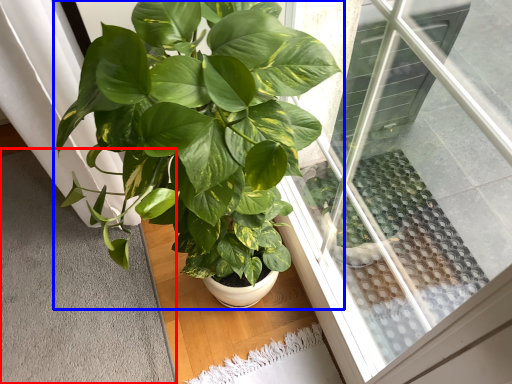
Question: Which object is closer to the camera taking this photo, gray (highlighted by a red box) or houseplant (highlighted by a blue box)?

Choices:
 (A) gray
 (B) houseplant

Answer: (B)